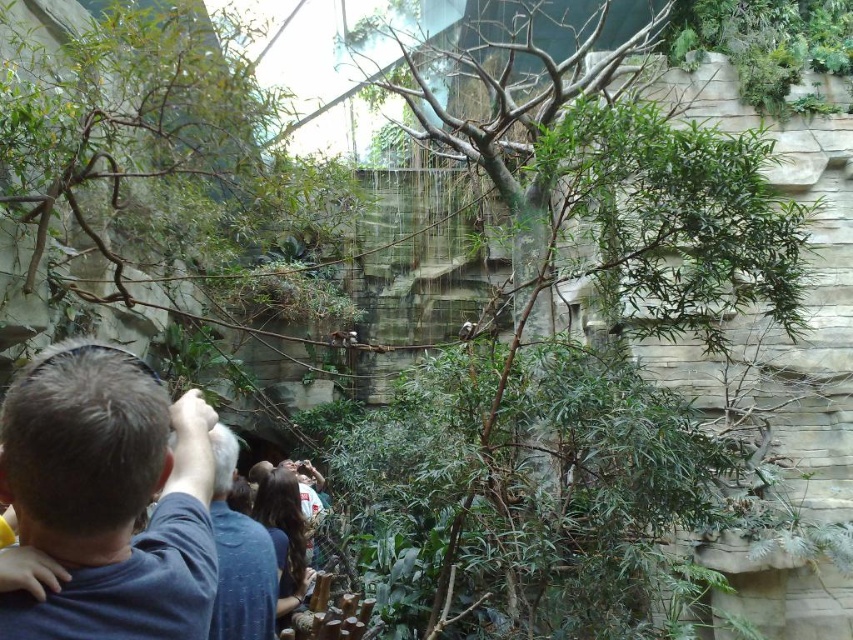
Is dark blue shirt at center above dark brown hair at center?

Yes, dark blue shirt at center is above dark brown hair at center.

From the picture: Does dark blue shirt at center come in front of dark brown hair at center?

Yes, it is.

Who is more distant from viewer, (218, 470) or (267, 516)?

The point (267, 516) is more distant.

Identify the location of dark blue shirt at center. This screenshot has width=853, height=640. (239, 556).

How distant is green leafy tree at center from dark brown hair at center?

A distance of 23.30 meters exists between green leafy tree at center and dark brown hair at center.

Consider the image. Can you confirm if green leafy tree at center is shorter than dark brown hair at center?

No, green leafy tree at center is not shorter than dark brown hair at center.

Who is more forward, (534, 554) or (297, 502)?

Positioned in front is point (534, 554).

The width and height of the screenshot is (853, 640). I want to click on green leafy tree at center, so click(x=573, y=352).

Does dark blue shirt at lower left have a larger size compared to dark brown hair at center?

Correct, dark blue shirt at lower left is larger in size than dark brown hair at center.

Where is `dark blue shirt at lower left`? The height and width of the screenshot is (640, 853). dark blue shirt at lower left is located at coordinates (108, 497).

The width and height of the screenshot is (853, 640). Describe the element at coordinates (108, 497) in the screenshot. I see `dark blue shirt at lower left` at that location.

Locate an element on the screen. This screenshot has width=853, height=640. dark blue shirt at lower left is located at coordinates (108, 497).